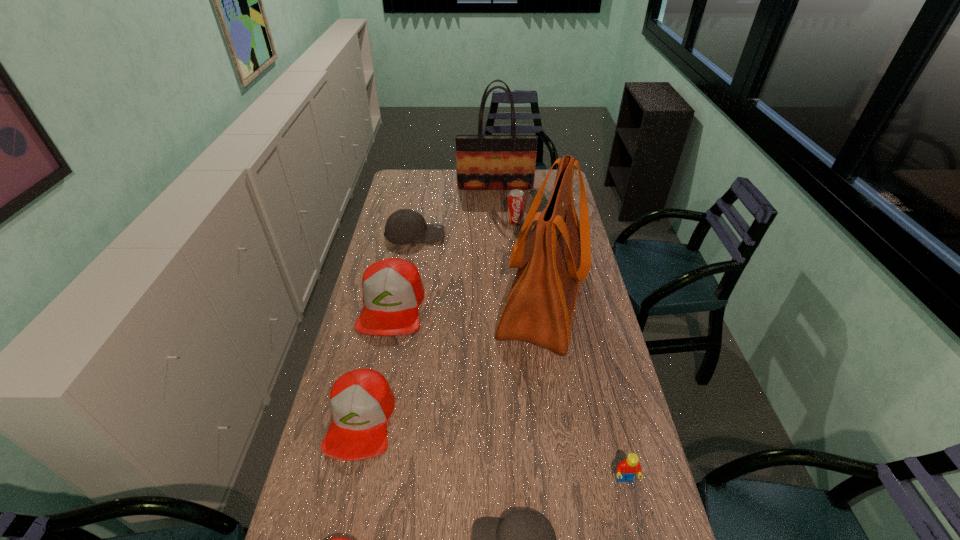
What are the coordinates of `the farthest object` in the screenshot? It's located at (484, 162).

I want to click on the nearer shopping bag, so click(x=556, y=257).

This screenshot has height=540, width=960. I want to click on soda can, so click(516, 199).

Where is `the tallest baseball cap`? Image resolution: width=960 pixels, height=540 pixels. the tallest baseball cap is located at coordinates (392, 288).

You are a GUI agent. You are given a task and a screenshot of the screen. Output one action in this format:
    pyautogui.click(x=<x>, y=<y>)
    Task: Click on the biggest red baseball cap
    
    Given the screenshot: What is the action you would take?
    pyautogui.click(x=392, y=288)

The width and height of the screenshot is (960, 540). I want to click on the bigger gray baseball cap, so click(404, 226).

Image resolution: width=960 pixels, height=540 pixels. What are the coordinates of `the farther gray baseball cap` in the screenshot? It's located at (404, 226).

Where is `the third nearest baseball cap`? The height and width of the screenshot is (540, 960). the third nearest baseball cap is located at coordinates (361, 400).

This screenshot has height=540, width=960. I want to click on the sixth farthest object, so click(361, 400).

You are a GUI agent. You are given a task and a screenshot of the screen. Output one action in this format:
    pyautogui.click(x=<x>, y=<y>)
    Task: Click on the Lego
    Image resolution: width=960 pixels, height=540 pixels.
    Given the screenshot: What is the action you would take?
    pyautogui.click(x=626, y=470)